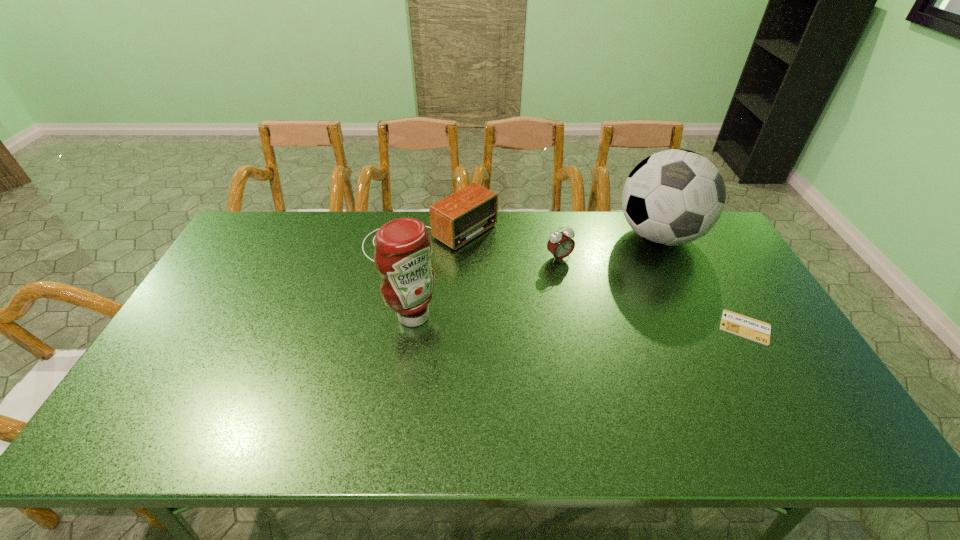
Identify the location of vacant area that satisfies the following two spatial constraints: 1. on the front side of the radio receiver; 2. on the left side of the identity card. The image size is (960, 540). tap(420, 327).